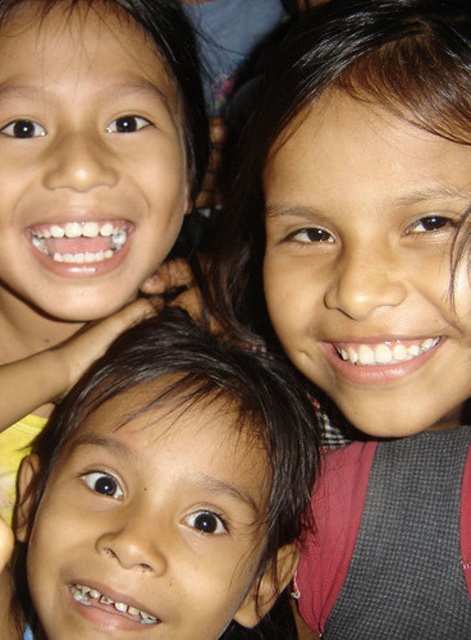
Can you confirm if smooth skin face at upper right is taller than brown hair at center?

Indeed, smooth skin face at upper right has a greater height compared to brown hair at center.

Between point (437, 221) and point (276, 538), which one is positioned behind?

The point (276, 538) is behind.

What are the coordinates of `smooth skin face at upper right` in the screenshot? It's located at (370, 300).